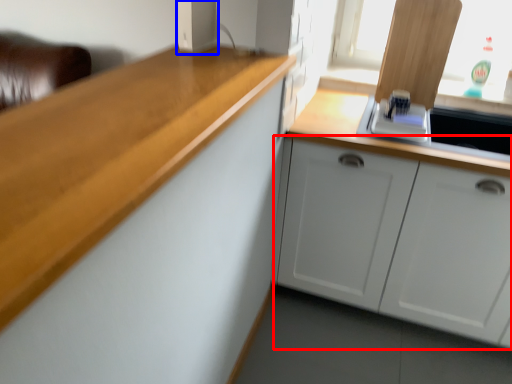
Question: Which object is further to the camera taking this photo, cabinetry (highlighted by a red box) or appliance (highlighted by a blue box)?

Choices:
 (A) cabinetry
 (B) appliance

Answer: (A)